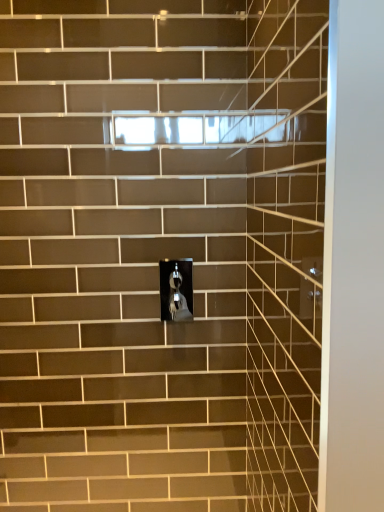
The height and width of the screenshot is (512, 384). Find the location of `satin nickel faucet at center`. satin nickel faucet at center is located at coordinates (176, 290).

What is the approximate width of satin nickel faucet at center?

satin nickel faucet at center is 0.79 inches in width.

Image resolution: width=384 pixels, height=512 pixels. What do you see at coordinates (176, 290) in the screenshot? I see `satin nickel faucet at center` at bounding box center [176, 290].

This screenshot has width=384, height=512. What are the coordinates of `satin nickel faucet at center` in the screenshot? It's located at (176, 290).